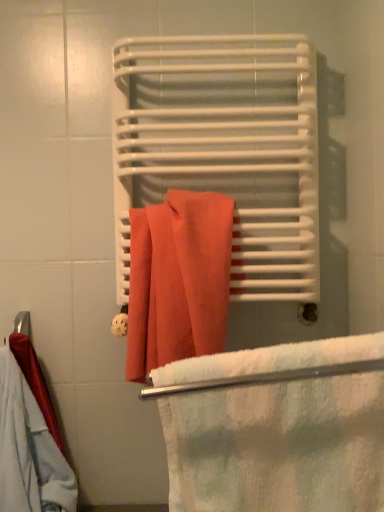
Question: Can you confirm if cotton towel at center is thinner than white soft towel at center?

Choices:
 (A) yes
 (B) no

Answer: (A)

Question: Can you confirm if cotton towel at center is shorter than white soft towel at center?

Choices:
 (A) yes
 (B) no

Answer: (B)

Question: Is cotton towel at center far away from white soft towel at center?

Choices:
 (A) yes
 (B) no

Answer: (B)

Question: Is cotton towel at center closer to camera compared to white soft towel at center?

Choices:
 (A) yes
 (B) no

Answer: (B)

Question: Is white soft towel at center inside cotton towel at center?

Choices:
 (A) yes
 (B) no

Answer: (B)

Question: Is matte orange towel at center in front of or behind cotton towel at center in the image?

Choices:
 (A) behind
 (B) front

Answer: (A)

Question: Which is correct: matte orange towel at center is inside cotton towel at center, or outside of it?

Choices:
 (A) outside
 (B) inside

Answer: (A)

Question: Considering the positions of matte orange towel at center and cotton towel at center in the image, is matte orange towel at center bigger or smaller than cotton towel at center?

Choices:
 (A) small
 (B) big

Answer: (B)

Question: From their relative heights in the image, would you say matte orange towel at center is taller or shorter than cotton towel at center?

Choices:
 (A) tall
 (B) short

Answer: (A)

Question: Based on their sizes in the image, would you say white soft towel at center is bigger or smaller than matte orange towel at center?

Choices:
 (A) big
 (B) small

Answer: (B)

Question: Is white soft towel at center wider or thinner than matte orange towel at center?

Choices:
 (A) thin
 (B) wide

Answer: (B)

Question: Is point (319, 435) closer or farther from the camera than point (198, 181)?

Choices:
 (A) farther
 (B) closer

Answer: (B)

Question: In terms of height, does white soft towel at center look taller or shorter compared to matte orange towel at center?

Choices:
 (A) tall
 (B) short

Answer: (B)

Question: In the image, is white soft towel at center positioned in front of or behind cotton towel at center?

Choices:
 (A) front
 (B) behind

Answer: (A)

Question: Which is correct: white soft towel at center is inside cotton towel at center, or outside of it?

Choices:
 (A) inside
 (B) outside

Answer: (B)